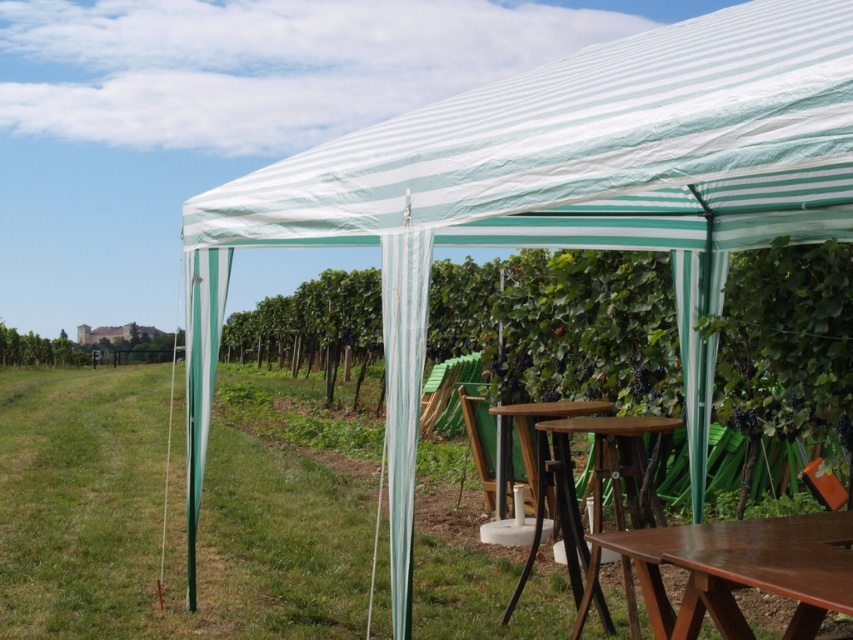
Between green grass at center and wooden at center, which one appears on the left side from the viewer's perspective?

green grass at center is more to the left.

Is green grass at center to the left of wooden at center from the viewer's perspective?

Indeed, green grass at center is positioned on the left side of wooden at center.

Locate an element on the screen. The image size is (853, 640). green grass at center is located at coordinates (167, 518).

Can you confirm if wooden picnic table at center is shorter than brown wooden table at lower right?

No.

Is wooden picnic table at center wider than brown wooden table at lower right?

Correct, the width of wooden picnic table at center exceeds that of brown wooden table at lower right.

Between point (582, 552) and point (654, 625), which one is positioned in front?

Point (654, 625) is more forward.

Find the location of a particular element. wooden picnic table at center is located at coordinates (596, 477).

Is wooden picnic table at center bigger than wooden at center?

Yes, wooden picnic table at center is bigger than wooden at center.

Consider the image. Who is more forward, (643,492) or (509,465)?

Positioned in front is point (643,492).

Who is more forward, (x=566, y=458) or (x=463, y=394)?

Point (x=566, y=458) is in front.

Locate an element on the screen. This screenshot has height=640, width=853. wooden picnic table at center is located at coordinates (596, 477).